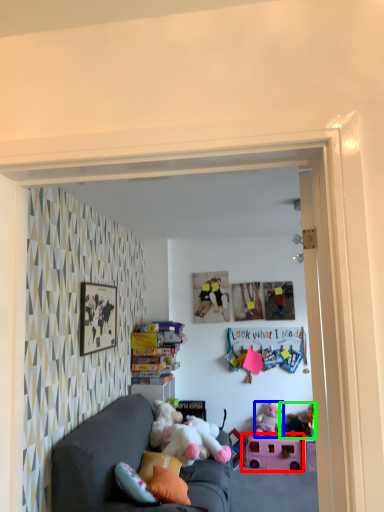
Question: Which is farther away from toy (highlighted by a red box)? toy (highlighted by a blue box) or toy (highlighted by a green box)?

Choices:
 (A) toy
 (B) toy

Answer: (B)